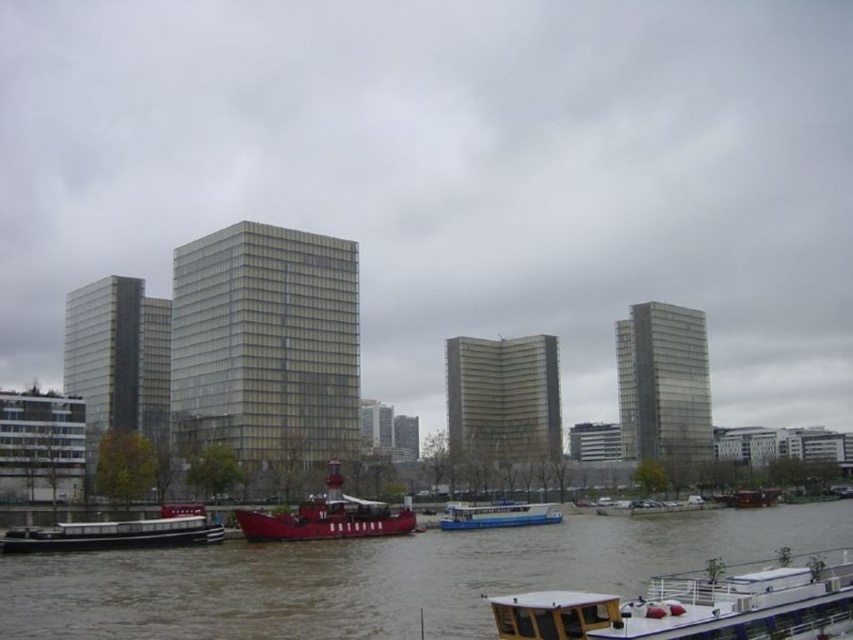
You are standing at the origin point of the image coordinate system. Where is the brown matte water at lower center located in 2D coordinates?

The brown matte water at lower center is located at coordinates point (381, 577).

Consider the image. You are standing on the riverbank and want to board the wooden deck boat at lower right and the white glossy boat at center. Which boat can you reach first without moving your position?

The wooden deck boat at lower right is closer to the viewer than the white glossy boat at center, so you can reach the wooden deck boat at lower right first without moving your position.

You are standing at the point marked by the coordinates point (695, 605) in the waterfront scene. What object are you standing on?

The point (695, 605) indicates the wooden deck boat at lower right, so you are standing on the wooden deck boat at lower right.